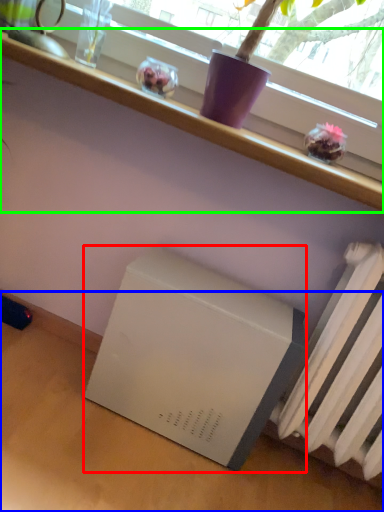
Question: Which is nearer to the appliance (highlighted by a red box)? table (highlighted by a blue box) or furniture (highlighted by a green box).

Choices:
 (A) table
 (B) furniture

Answer: (A)